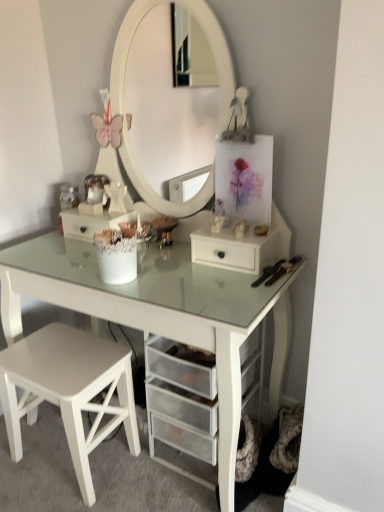
Question: Is white matte drawer at center positioned far away from white matte stool at lower left?

Choices:
 (A) yes
 (B) no

Answer: (B)

Question: Is white matte drawer at center with white matte stool at lower left?

Choices:
 (A) yes
 (B) no

Answer: (B)

Question: Is white matte drawer at center further to the viewer compared to white matte stool at lower left?

Choices:
 (A) yes
 (B) no

Answer: (A)

Question: Is white matte drawer at center taller than white matte stool at lower left?

Choices:
 (A) yes
 (B) no

Answer: (B)

Question: Is white matte drawer at center positioned before white matte stool at lower left?

Choices:
 (A) no
 (B) yes

Answer: (A)

Question: Is white mesh drawer at center to the left or to the right of white glass table at center in the image?

Choices:
 (A) right
 (B) left

Answer: (B)

Question: Is white mesh drawer at center in front of or behind white glass table at center in the image?

Choices:
 (A) front
 (B) behind

Answer: (B)

Question: Is white mesh drawer at center bigger or smaller than white glass table at center?

Choices:
 (A) big
 (B) small

Answer: (B)

Question: Is point (110, 225) positioned closer to the camera than point (238, 330)?

Choices:
 (A) closer
 (B) farther

Answer: (B)

Question: Is white mesh drawer at center inside or outside of white matte stool at lower left?

Choices:
 (A) inside
 (B) outside

Answer: (B)

Question: In terms of size, does white mesh drawer at center appear bigger or smaller than white matte stool at lower left?

Choices:
 (A) small
 (B) big

Answer: (A)

Question: Is white mesh drawer at center wider or thinner than white matte stool at lower left?

Choices:
 (A) thin
 (B) wide

Answer: (A)

Question: Based on their positions, is white mesh drawer at center located to the left or right of white matte stool at lower left?

Choices:
 (A) right
 (B) left

Answer: (A)

Question: In the image, is white glass table at center on the left side or the right side of white matte drawer at center?

Choices:
 (A) left
 (B) right

Answer: (A)

Question: Do you think white glass table at center is within white matte drawer at center, or outside of it?

Choices:
 (A) inside
 (B) outside

Answer: (B)